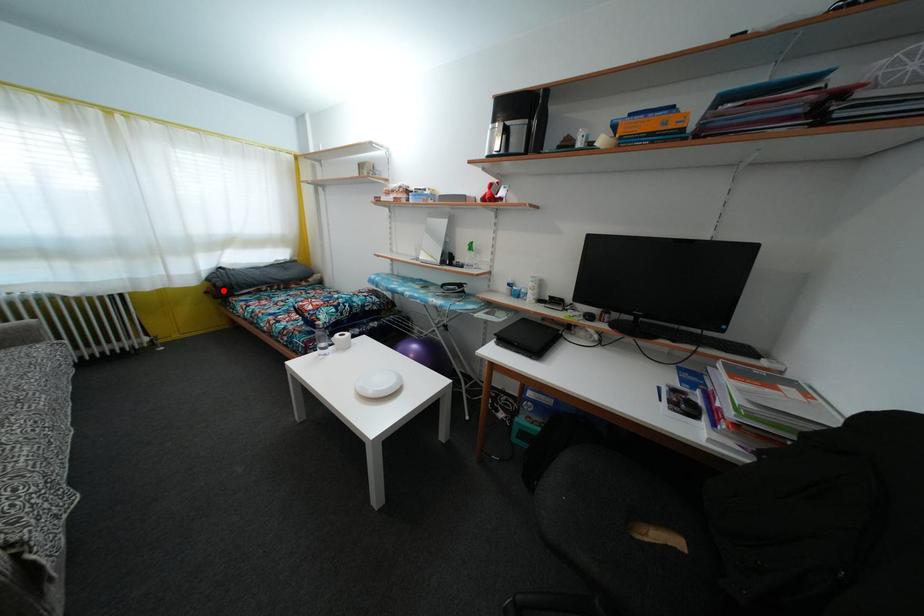
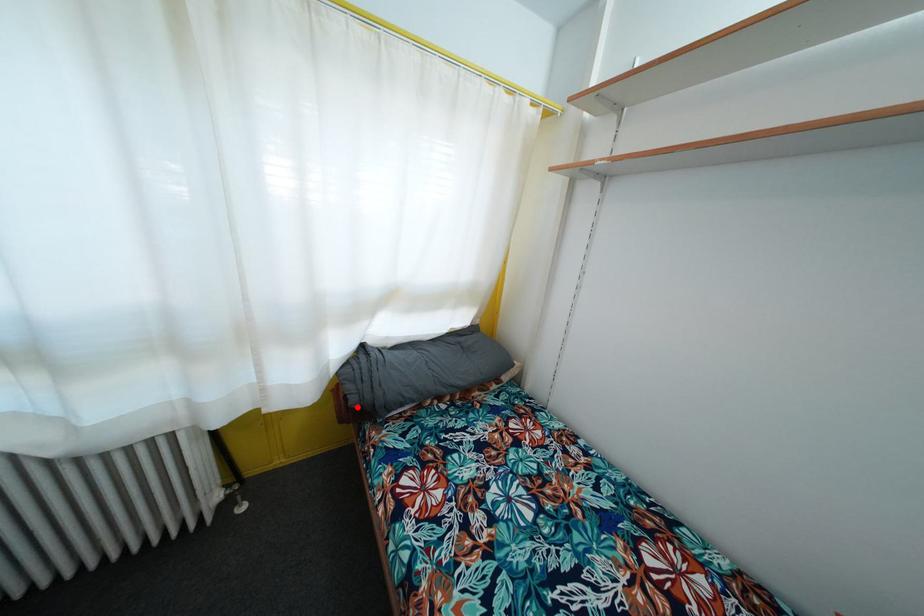
I am providing you with two images of the same scene from different viewpoints. A red point is marked on the first image and another point is marked on the second image. Do the highlighted points in image1 and image2 indicate the same real-world spot?

Yes